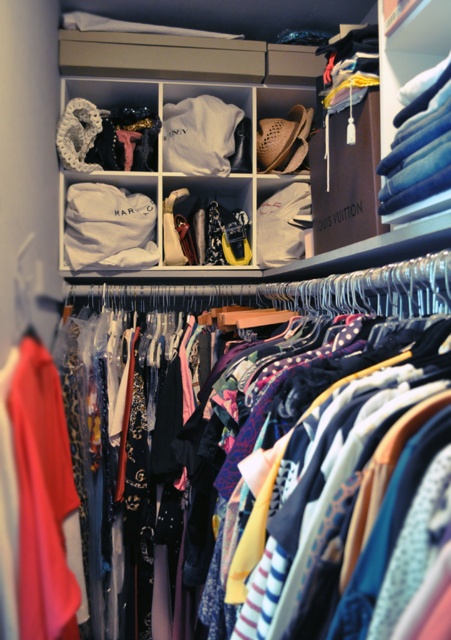
You are a delivery person who needs to place a new pair of shoes that requires 5 feet of space between it and the existing shoes. Can you fit the new shoes between the denim jeans at upper right and the matte white shoes at center?

The distance between the denim jeans at upper right and the matte white shoes at center is 4.83 feet, which is less than the required 5 feet. Therefore, you cannot fit the new shoes between them.

You are organizing your closet and want to retrieve the matte white shoes at center. However, the denim jeans at upper right are blocking your access. Can you remove the jeans first to get to the shoes?

The denim jeans at upper right is in front of matte white shoes at center, so you can remove the denim jeans at upper right first to access the matte white shoes at center.

You are standing in front of the closet and want to reach the point at the bottom right corner. You notice two points marked in the image. One is at point (x=51, y=568) and the other is at point (x=405, y=83). Which point is closer to the bottom right corner?

Point (x=51, y=568) is closer to the bottom right corner because it is positioned lower and further to the right compared to point (x=405, y=83).